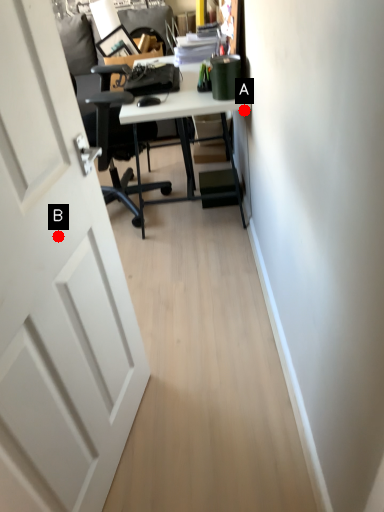
Question: Two points are circled on the image, labeled by A and B beside each circle. Among these points, which one is nearest to the camera?

Choices:
 (A) A is closer
 (B) B is closer

Answer: (B)